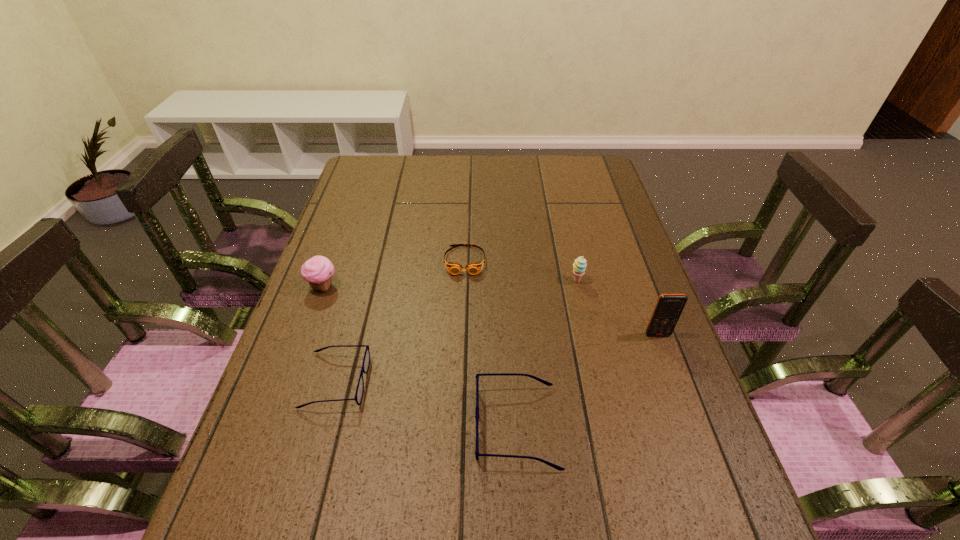
In the image, there is a desktop. Identify the location of free space at the far edge. The image size is (960, 540). (405, 155).

Find the location of a particular element. This screenshot has width=960, height=540. blank space at the near edge of the desktop is located at coordinates (605, 460).

Locate an element on the screen. This screenshot has height=540, width=960. free space at the left edge of the desktop is located at coordinates (274, 418).

In the image, there is a desktop. Where is `vacant space at the right edge`? The image size is (960, 540). vacant space at the right edge is located at coordinates (590, 223).

Find the location of `free space at the far right corner of the desktop`. free space at the far right corner of the desktop is located at coordinates (594, 176).

The width and height of the screenshot is (960, 540). I want to click on free space between the fourth tallest object and the goggles, so click(491, 343).

Identify the location of free space between the goggles and the third nearest object. (562, 298).

Identify the location of vacant space that's between the sherbert and the cupcake. (450, 284).

The width and height of the screenshot is (960, 540). Find the location of `free area in between the fourth tallest object and the cupcake`. free area in between the fourth tallest object and the cupcake is located at coordinates (420, 356).

The image size is (960, 540). I want to click on vacant space that's between the sherbert and the fourth tallest object, so click(546, 354).